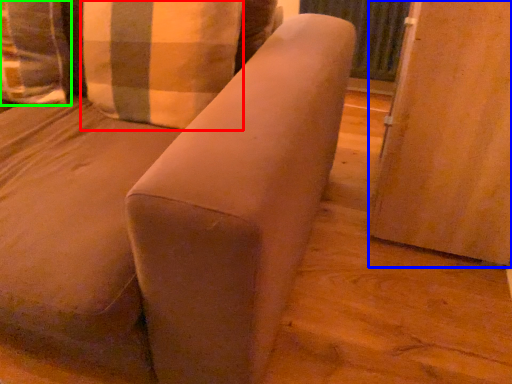
Question: Which object is the farthest from pillow (highlighted by a red box)? Choose among these: screen door (highlighted by a blue box) or pillow (highlighted by a green box).

Choices:
 (A) screen door
 (B) pillow

Answer: (A)